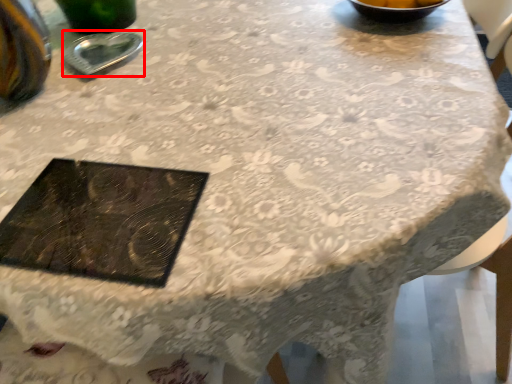
Question: From the image's perspective, what is the correct spatial relationship of tableware (annotated by the red box) in relation to tray?

Choices:
 (A) above
 (B) below

Answer: (A)